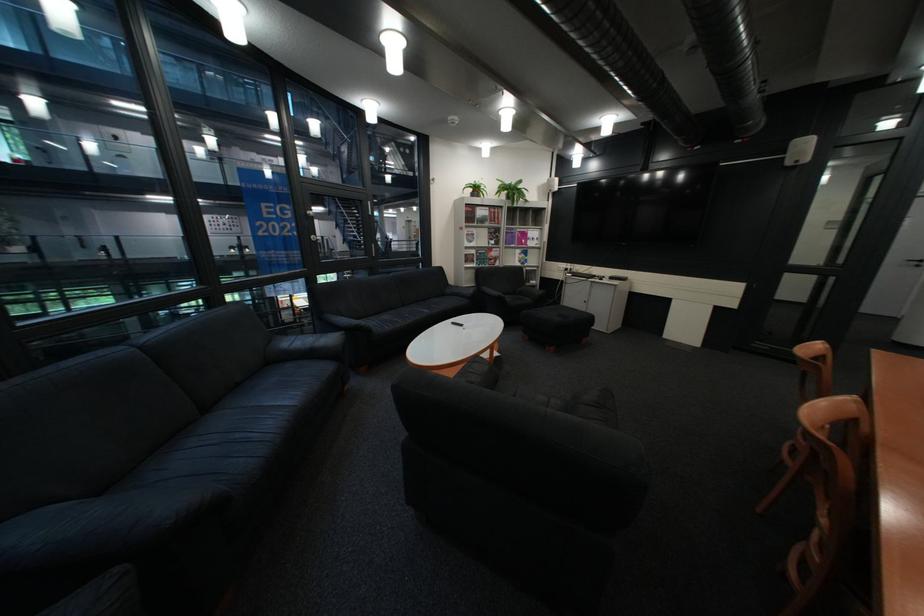
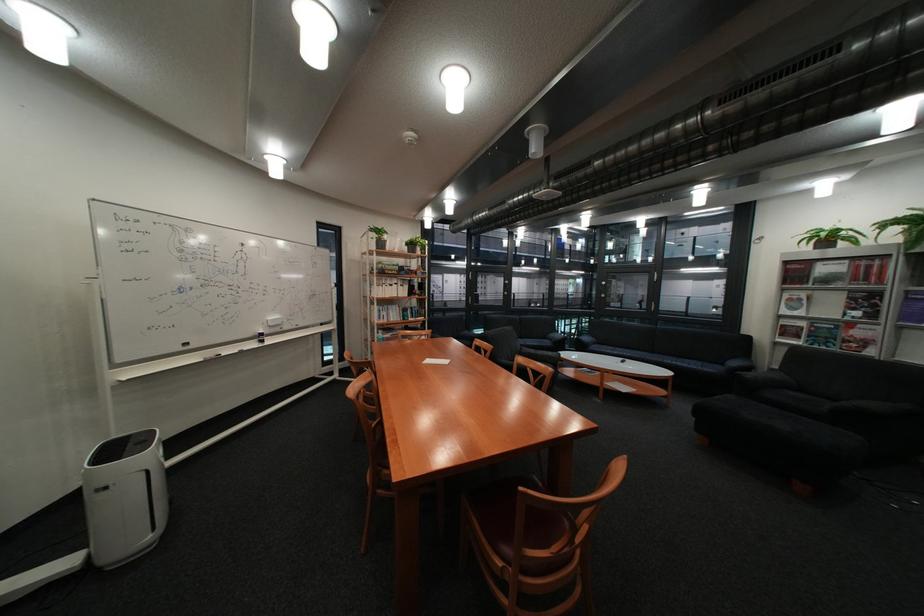
The point at (458,294) is marked in the first image. Where is the corresponding point in the second image?

(737, 363)